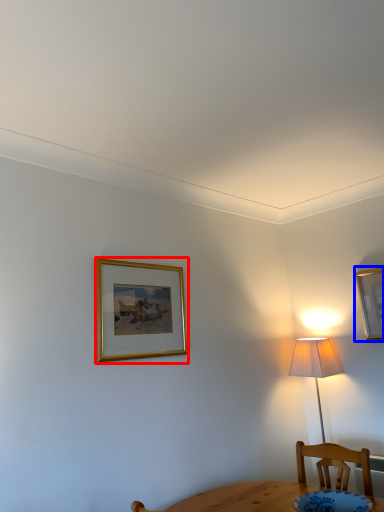
Question: Which point is further to the camera, picture frame (highlighted by a red box) or picture frame (highlighted by a blue box)?

Choices:
 (A) picture frame
 (B) picture frame

Answer: (B)